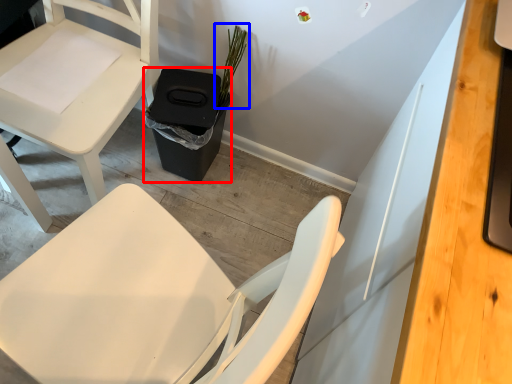
Question: Which object is closer to the camera taking this photo, trash bin/can (highlighted by a red box) or plant (highlighted by a blue box)?

Choices:
 (A) trash bin/can
 (B) plant

Answer: (B)